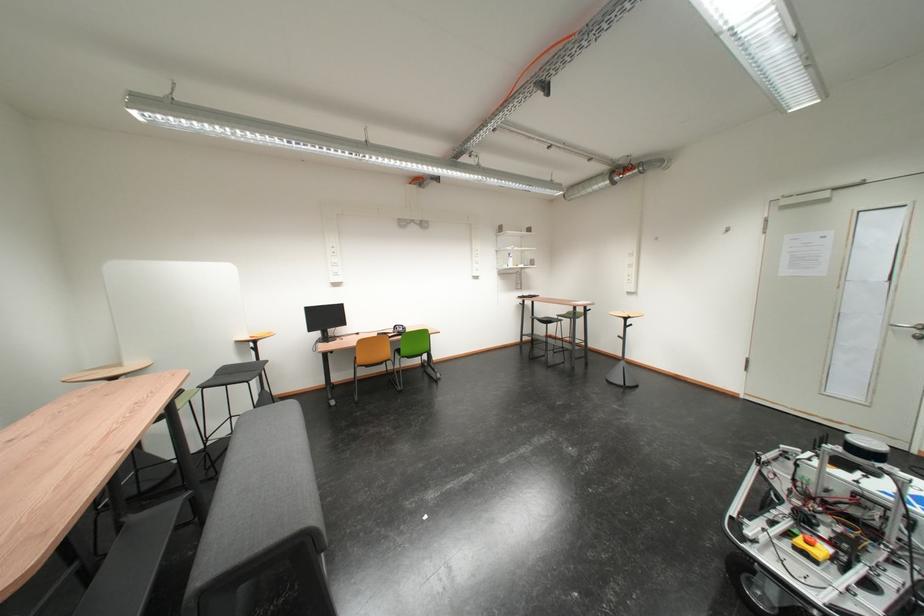
The image size is (924, 616). What do you see at coordinates (825, 554) in the screenshot? I see `the red push button` at bounding box center [825, 554].